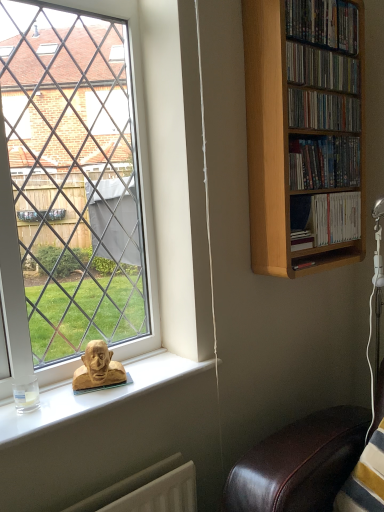
Question: Is matte wooden shelf at upper right, which ranks as the fourth book in top-to-bottom order, looking in the opposite direction of wooden dvds at upper right, arranged as the 3th book when ordered from the bottom?

Choices:
 (A) yes
 (B) no

Answer: (B)

Question: Is matte wooden shelf at upper right, the 2th book from the bottom, outside of wooden dvds at upper right, arranged as the 3th book when ordered from the bottom?

Choices:
 (A) yes
 (B) no

Answer: (A)

Question: Can you confirm if matte wooden shelf at upper right, which ranks as the fourth book in top-to-bottom order, is positioned to the right of wooden dvds at upper right, arranged as the 3th book when ordered from the bottom?

Choices:
 (A) no
 (B) yes

Answer: (B)

Question: Considering the relative sizes of matte wooden shelf at upper right, the 2th book from the bottom, and wooden dvds at upper right, which is the third book from top to bottom, in the image provided, is matte wooden shelf at upper right, the 2th book from the bottom, bigger than wooden dvds at upper right, which is the third book from top to bottom,?

Choices:
 (A) no
 (B) yes

Answer: (B)

Question: Considering the relative sizes of matte wooden shelf at upper right, which ranks as the fourth book in top-to-bottom order, and wooden dvds at upper right, which is the third book from top to bottom, in the image provided, is matte wooden shelf at upper right, which ranks as the fourth book in top-to-bottom order, smaller than wooden dvds at upper right, which is the third book from top to bottom,?

Choices:
 (A) yes
 (B) no

Answer: (B)

Question: Is matte wooden shelf at upper right, the 2th book from the bottom, aimed at wooden dvds at upper right, which is the third book from top to bottom?

Choices:
 (A) yes
 (B) no

Answer: (B)

Question: From the image's perspective, is wooden shelf at upper right, which is counted as the fourth book, starting from the bottom, located beneath white paperbacks at upper right, which is counted as the fifth book, starting from the top?

Choices:
 (A) yes
 (B) no

Answer: (B)

Question: Considering the relative positions of wooden shelf at upper right, marked as the second book in a top-to-bottom arrangement, and white paperbacks at upper right, the first book in the bottom-to-top sequence, in the image provided, is wooden shelf at upper right, marked as the second book in a top-to-bottom arrangement, to the right of white paperbacks at upper right, the first book in the bottom-to-top sequence, from the viewer's perspective?

Choices:
 (A) no
 (B) yes

Answer: (A)

Question: Is white paperbacks at upper right, the first book in the bottom-to-top sequence, completely or partially inside wooden shelf at upper right, which is counted as the fourth book, starting from the bottom?

Choices:
 (A) yes
 (B) no

Answer: (B)

Question: Is wooden shelf at upper right, which is counted as the fourth book, starting from the bottom, positioned far away from white paperbacks at upper right, which is counted as the fifth book, starting from the top?

Choices:
 (A) no
 (B) yes

Answer: (A)

Question: Does wooden shelf at upper right, marked as the second book in a top-to-bottom arrangement, have a greater height compared to white paperbacks at upper right, which is counted as the fifth book, starting from the top?

Choices:
 (A) no
 (B) yes

Answer: (A)

Question: From a real-world perspective, is wooden shelf at upper right, which is counted as the fourth book, starting from the bottom, on top of white paperbacks at upper right, which is counted as the fifth book, starting from the top?

Choices:
 (A) no
 (B) yes

Answer: (B)

Question: From a real-world perspective, is translucent glass coffee cup at lower left on wooden shelf at upper right, marked as the second book in a top-to-bottom arrangement?

Choices:
 (A) no
 (B) yes

Answer: (A)